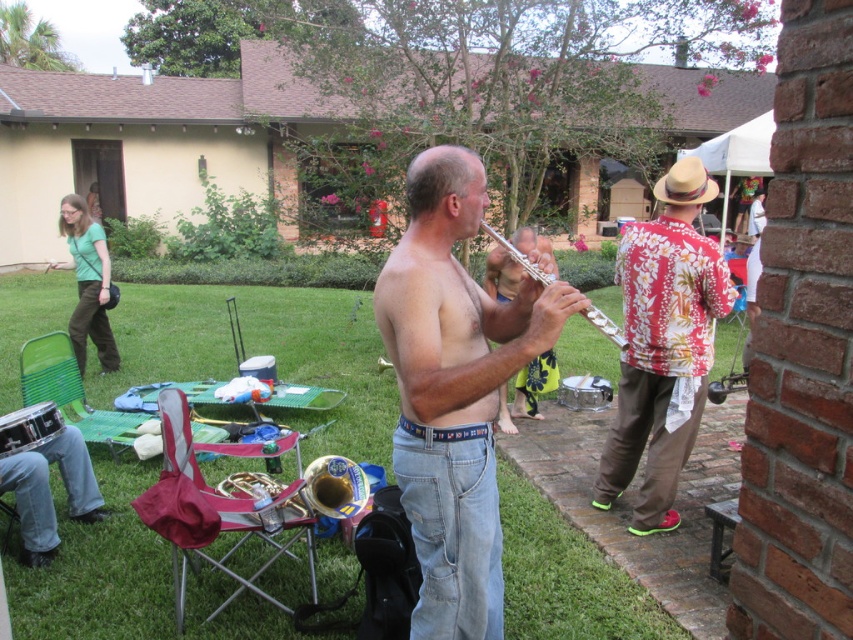
Question: Is shiny silver flute at center wider than gold brass trumpet at center?

Choices:
 (A) yes
 (B) no

Answer: (B)

Question: Which point is closer to the camera?

Choices:
 (A) (355, 492)
 (B) (442, 582)
 (C) (49, 403)
 (D) (643, 344)

Answer: (B)

Question: Is brushed metal drum at lower left thinner than silver metallic flute at center?

Choices:
 (A) no
 (B) yes

Answer: (B)

Question: Which point appears farthest from the camera in this image?

Choices:
 (A) (685, 180)
 (B) (55, 432)

Answer: (B)

Question: Which of the following is the closest to the observer?

Choices:
 (A) floral cotton shirt at right
 (B) brushed metal drum at lower left
 (C) shiny silver flute at center

Answer: (C)

Question: Can you confirm if natural straw cowboy hat at upper right is positioned to the left of silver metallic flute at center?

Choices:
 (A) yes
 (B) no

Answer: (B)